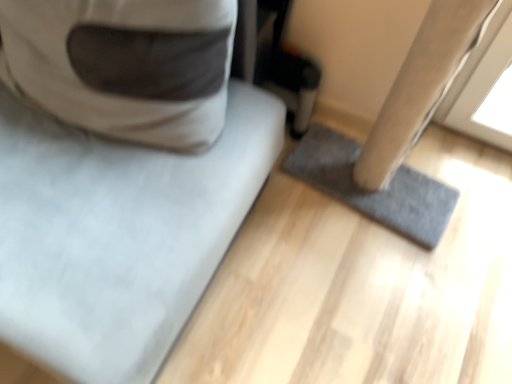
Find the location of a particular element. This screenshot has height=384, width=512. gray fabric cat bed at upper left is located at coordinates (119, 233).

Describe the element at coordinates (119, 233) in the screenshot. I see `gray fabric cat bed at upper left` at that location.

Measure the distance between gray fabric cat bed at upper left and camera.

The distance of gray fabric cat bed at upper left from camera is 27.74 inches.

Where is `gray fabric cat bed at upper left`? gray fabric cat bed at upper left is located at coordinates (119, 233).